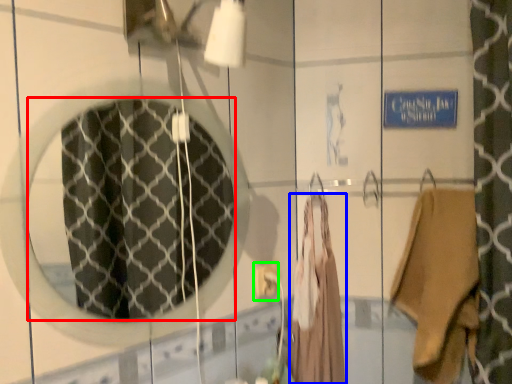
Question: Which object is the closest to the mirror (highlighted by a red box)? Choose among these: clothing (highlighted by a blue box) or electric outlet (highlighted by a green box).

Choices:
 (A) clothing
 (B) electric outlet

Answer: (A)